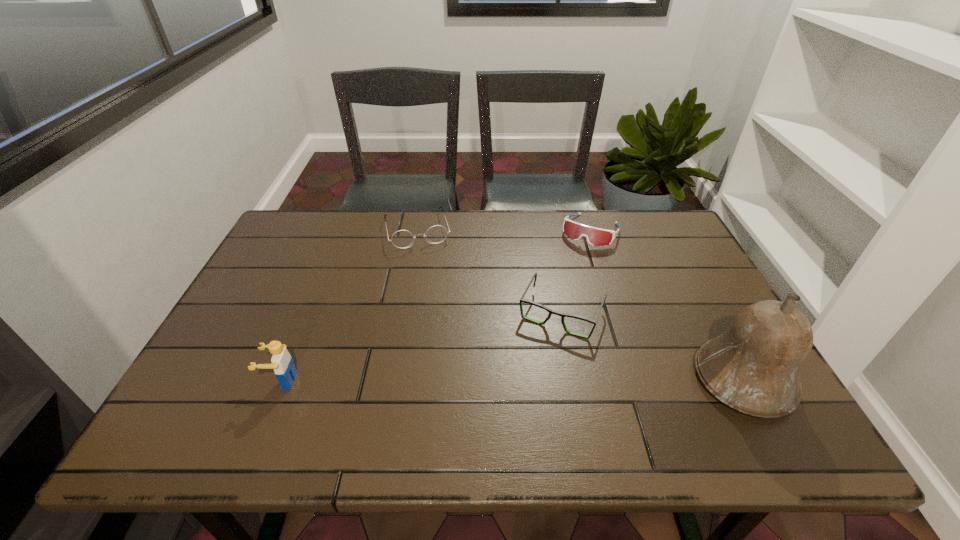
Image resolution: width=960 pixels, height=540 pixels. Identify the location of vacant area at the left edge. (260, 332).

Find the location of a particular element. vacant space at the right edge of the desktop is located at coordinates (704, 328).

This screenshot has height=540, width=960. Find the location of `free region at the far right corner of the desktop`. free region at the far right corner of the desktop is located at coordinates (630, 210).

Locate an element on the screen. free space between the tallest object and the goggles is located at coordinates (666, 305).

What are the coordinates of `free space between the tallest object and the second object from left to right` in the screenshot? It's located at (581, 305).

This screenshot has width=960, height=540. Identify the location of free space between the leftmost object and the third farthest object. (421, 347).

Identify the location of free area in between the bell and the farther spectacles. This screenshot has width=960, height=540. (581, 305).

Identify the location of free space between the goggles and the farther spectacles. (504, 230).

The image size is (960, 540). Find the location of `free space between the left spectacles and the third farthest object`. free space between the left spectacles and the third farthest object is located at coordinates (490, 272).

The width and height of the screenshot is (960, 540). I want to click on empty space that is in between the goggles and the Lego, so (x=436, y=306).